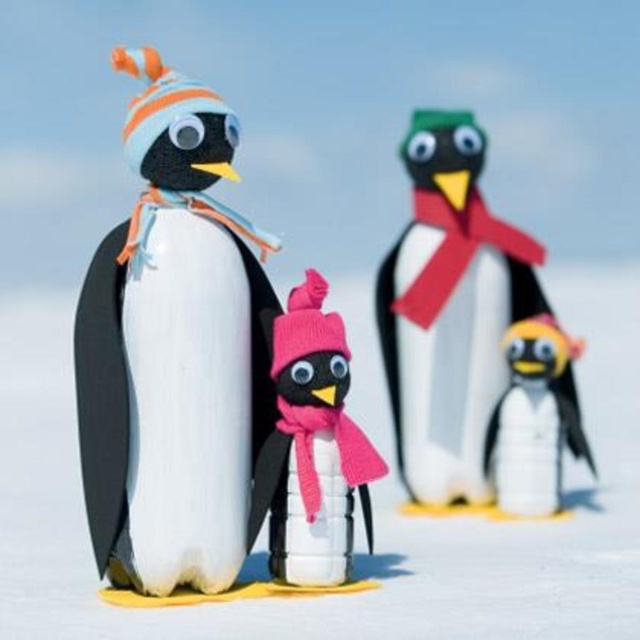
Question: Among these points, which one is farthest from the camera?

Choices:
 (A) click(x=205, y=632)
 (B) click(x=449, y=180)

Answer: (B)

Question: Does white matte snow at center lie in front of matte black penguin at left?

Choices:
 (A) no
 (B) yes

Answer: (B)

Question: Which is nearer to the matte black penguin at center?

Choices:
 (A) pink knitted hat at center
 (B) matte black penguin at left
 (C) matte yellow penguin at lower right
 (D) white matte snow at center

Answer: (C)

Question: Observing the image, what is the correct spatial positioning of matte black penguin at left in reference to matte yellow penguin at lower right?

Choices:
 (A) left
 (B) right

Answer: (A)

Question: Which object appears closest to the camera in this image?

Choices:
 (A) matte black penguin at left
 (B) matte black penguin at center
 (C) matte yellow penguin at lower right

Answer: (A)

Question: Is white matte snow at center below matte black penguin at left?

Choices:
 (A) yes
 (B) no

Answer: (A)